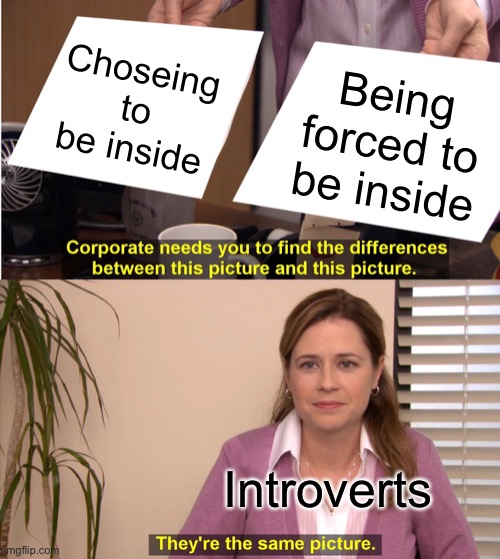
Locate an element on the screen. The image size is (500, 559). wall is located at coordinates (209, 364).